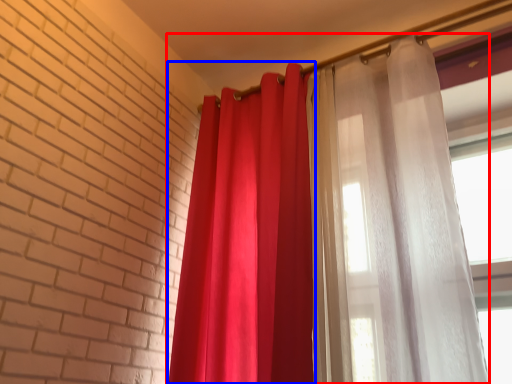
Question: Which point is closer to the camera, curtain (highlighted by a red box) or curtain (highlighted by a blue box)?

Choices:
 (A) curtain
 (B) curtain

Answer: (A)